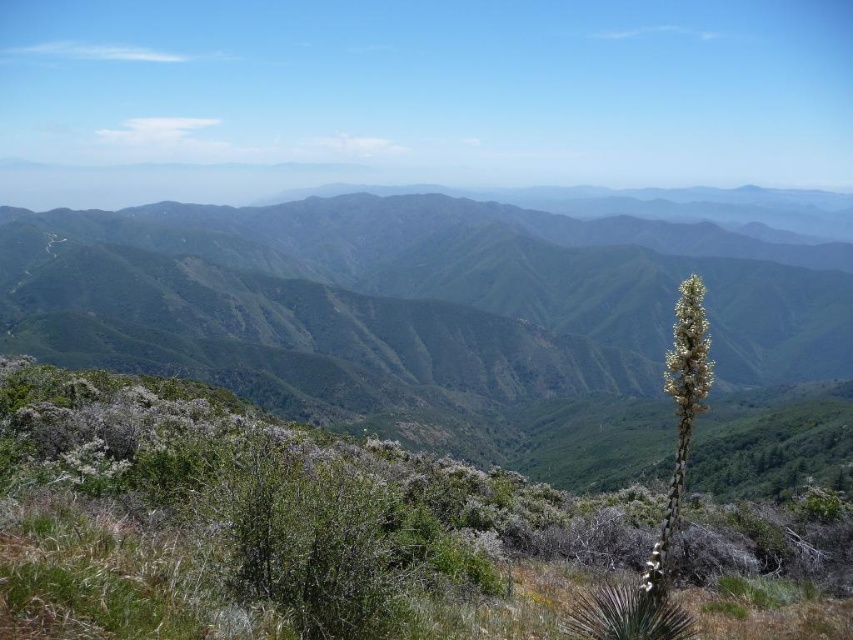
You are a hiker planning to take a photo of the green textured mountain range at center and the green leafy plant at center from a distance. Which object will appear larger in the photo?

The green textured mountain range at center will appear larger in the photo because it is much taller than the green leafy plant at center.

You are a hiker standing at the base of the green textured mountain range at center. You want to reach the summit. Which direction should you head towards?

The green textured mountain range at center is located at point (x=450, y=324), so you should head towards that coordinate to reach the summit.